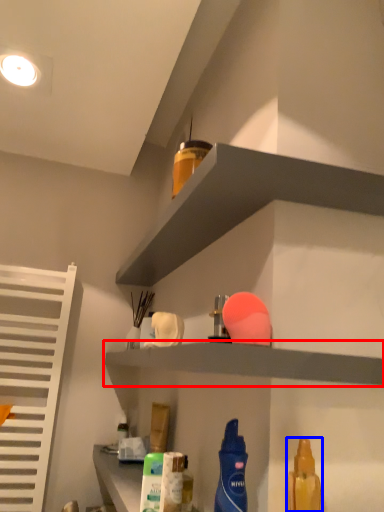
Question: Which object is closer to the camera taking this photo, shelf (highlighted by a red box) or cleaning product (highlighted by a blue box)?

Choices:
 (A) shelf
 (B) cleaning product

Answer: (B)